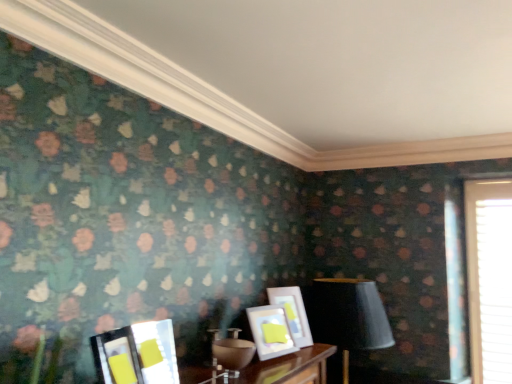
Question: Which is correct: matte white picture frame at center, positioned as the third picture frame in front-to-back order, is inside matte glass picture frame at lower left, the 3th picture frame in the back-to-front sequence, or outside of it?

Choices:
 (A) outside
 (B) inside

Answer: (A)

Question: Is matte white picture frame at center, positioned as the third picture frame in front-to-back order, taller or shorter than matte glass picture frame at lower left, the 2th picture frame from the front?

Choices:
 (A) tall
 (B) short

Answer: (A)

Question: Which object is the closest to the matte white picture frame at center, which ranks as the fourth picture frame in front-to-back order?

Choices:
 (A) matte glass picture frame at lower left, the 2th picture frame from the front
 (B) white textured blinds at right
 (C) matte white picture frame at center, positioned as the third picture frame in front-to-back order
 (D) matte black picture frame at lower left, the 1th picture frame viewed from the front
 (E) matte black lampshade at center

Answer: (C)

Question: Considering the real-world distances, which object is closest to the matte white picture frame at center, positioned as the third picture frame in front-to-back order?

Choices:
 (A) matte white picture frame at center, which ranks as the fourth picture frame in front-to-back order
 (B) matte black picture frame at lower left, the 1th picture frame viewed from the front
 (C) matte black lampshade at center
 (D) white textured blinds at right
 (E) matte glass picture frame at lower left, the 3th picture frame in the back-to-front sequence

Answer: (A)